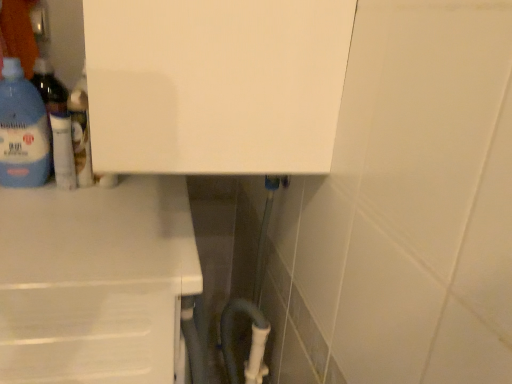
The width and height of the screenshot is (512, 384). In order to click on free space in front of translucent plastic bottle at left, the 2th bottle positioned from the right in this screenshot , I will do `click(23, 202)`.